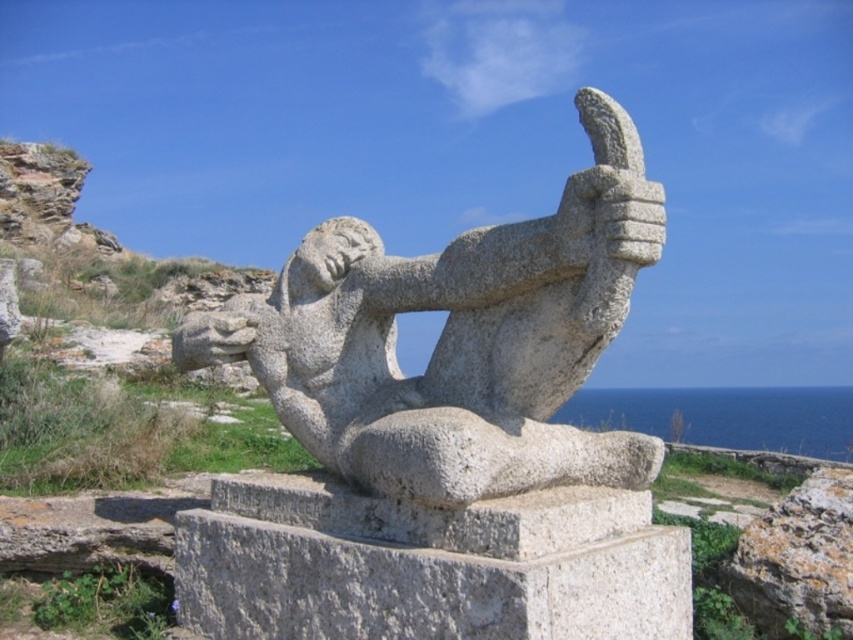
Between granite statue at center and granite rock at lower right, which one has more height?

Standing taller between the two is granite statue at center.

Does granite statue at center have a greater height compared to granite rock at lower right?

Yes.

Locate an element on the screen. The width and height of the screenshot is (853, 640). granite statue at center is located at coordinates (457, 339).